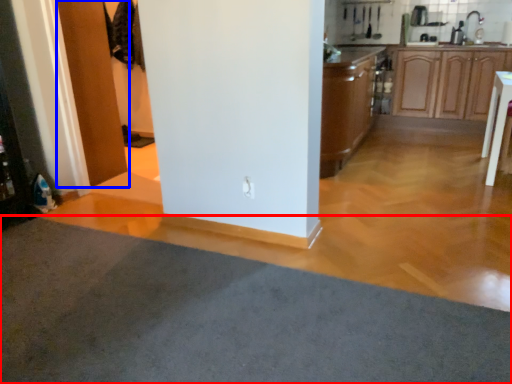
Question: Which point is further to the camera, plain (highlighted by a red box) or door (highlighted by a blue box)?

Choices:
 (A) plain
 (B) door

Answer: (B)